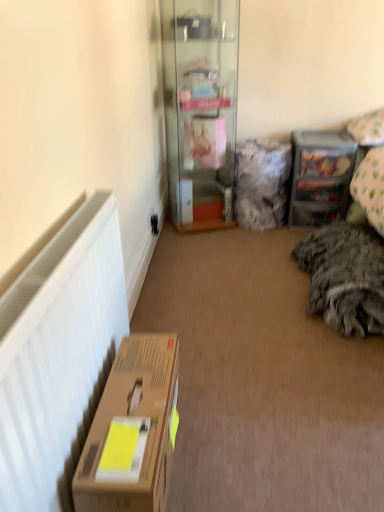
Image resolution: width=384 pixels, height=512 pixels. What do you see at coordinates (58, 352) in the screenshot?
I see `white matte radiator at left` at bounding box center [58, 352].

Locate an element on the screen. clear glass cabinet at center is located at coordinates (200, 109).

Image resolution: width=384 pixels, height=512 pixels. What do you see at coordinates (368, 128) in the screenshot?
I see `white fabric pillow at upper right, acting as the second pillow starting from the left` at bounding box center [368, 128].

You are a GUI agent. You are given a task and a screenshot of the screen. Output one action in this format:
    pyautogui.click(x=<x>, y=<y>)
    Task: Click on the brown cardboard box at lower left
    This screenshot has width=384, height=512.
    Given the screenshot: What is the action you would take?
    pyautogui.click(x=132, y=430)

Which point is more distant from viewer, (x=106, y=496) or (x=58, y=439)?

The point (x=58, y=439) is more distant.

Is white matte radiator at left a part of brown cardboard box at lower left?

Answer: No, brown cardboard box at lower left does not contain white matte radiator at left.

Between brown cardboard box at lower left and white matte radiator at left, which one has smaller size?

Smaller between the two is white matte radiator at left.

What's the angular difference between clear glass cabinet at center and clear plastic drawers at upper right's facing directions?

clear glass cabinet at center and clear plastic drawers at upper right are facing 15.3 degrees away from each other.

Is clear glass cabinet at center far from clear plastic drawers at upper right?

No.

Is clear glass cabinet at center wider than clear plastic drawers at upper right?

Yes, clear glass cabinet at center is wider than clear plastic drawers at upper right.

Does clear glass cabinet at center come in front of clear plastic drawers at upper right?

Yes, clear glass cabinet at center is closer to the camera.

Between point (108, 411) and point (373, 111), which one is positioned behind?

The point (373, 111) is farther from the camera.

Is brown cardboard box at lower left positioned in front of white fabric pillow at upper right, acting as the second pillow starting from the left?

Yes, it is.

Looking at their sizes, would you say brown cardboard box at lower left is wider or thinner than white fabric pillow at upper right, acting as the second pillow starting from the left?

In the image, brown cardboard box at lower left appears to be more narrow than white fabric pillow at upper right, acting as the second pillow starting from the left.

From the image's perspective, is clear plastic drawers at upper right located above or below white matte radiator at left?

clear plastic drawers at upper right is situated higher than white matte radiator at left in the image.

The width and height of the screenshot is (384, 512). I want to click on shelf positioned vertically above the white matte radiator at left (from a real-world perspective), so click(x=320, y=176).

Which is correct: clear plastic drawers at upper right is inside white matte radiator at left, or outside of it?

clear plastic drawers at upper right is spatially situated outside white matte radiator at left.

Between clear plastic drawers at upper right and white matte radiator at left, which one has larger size?

clear plastic drawers at upper right.

From a real-world perspective, which is physically below, clear plastic drawers at upper right or dark gray textured blanket at right?

dark gray textured blanket at right.

Could you tell me if clear plastic drawers at upper right is turned towards dark gray textured blanket at right?

Yes, clear plastic drawers at upper right is facing dark gray textured blanket at right.

Which object is further away from the camera taking this photo, clear plastic drawers at upper right or dark gray textured blanket at right?

clear plastic drawers at upper right is further away from the camera.

Would you consider clear plastic drawers at upper right to be distant from dark gray textured blanket at right?

No, clear plastic drawers at upper right is in close proximity to dark gray textured blanket at right.

Identify the location of cabinetry behind the dark gray textured blanket at right. (200, 109).

Looking at this image, is dark gray textured blanket at right far from clear glass cabinet at center?

Indeed, dark gray textured blanket at right is not near clear glass cabinet at center.

Does dark gray textured blanket at right have a greater width compared to clear glass cabinet at center?

Indeed, dark gray textured blanket at right has a greater width compared to clear glass cabinet at center.

Can you confirm if dark gray textured blanket at right is positioned to the left of clear glass cabinet at center?

Incorrect, dark gray textured blanket at right is not on the left side of clear glass cabinet at center.

Which is more to the left, brown cardboard box at lower left or clear plastic drawers at upper right?

brown cardboard box at lower left is more to the left.

Is the position of brown cardboard box at lower left less distant than that of clear plastic drawers at upper right?

Yes, it is.

From a real-world perspective, does brown cardboard box at lower left stand above clear plastic drawers at upper right?

No.

Where is `radiator that appears below the brown cardboard box at lower left (from a real-world perspective)`? This screenshot has width=384, height=512. radiator that appears below the brown cardboard box at lower left (from a real-world perspective) is located at coordinates (58, 352).

This screenshot has width=384, height=512. What are the coordinates of `shelf on the right of the clear glass cabinet at center` in the screenshot? It's located at (320, 176).

Based on their spatial positions, is clear glass cabinet at center or dark gray textured blanket at right further from clear plastic drawers at upper right?

clear glass cabinet at center.

In the scene shown: Based on their spatial positions, is white fabric pillow at upper right, acting as the second pillow starting from the left, or dark gray textured blanket at right further from clear glass cabinet at center?

dark gray textured blanket at right is positioned further to the anchor clear glass cabinet at center.

Based on their spatial positions, is white fabric pillow at upper right, the first pillow when ordered from right to left, or clear glass cabinet at center closer to dark gray textured blanket at right?

white fabric pillow at upper right, the first pillow when ordered from right to left.

Considering their positions, is clear glass cabinet at center positioned closer to fuzzy fabric pillow at center, marked as the first pillow in a left-to-right arrangement, than white fabric pillow at upper right, the first pillow when ordered from right to left?

The object closer to fuzzy fabric pillow at center, marked as the first pillow in a left-to-right arrangement, is clear glass cabinet at center.

Which object lies nearer to the anchor point white fabric pillow at upper right, the first pillow when ordered from right to left, clear glass cabinet at center or clear plastic drawers at upper right?

clear plastic drawers at upper right is closer to white fabric pillow at upper right, the first pillow when ordered from right to left.

Estimate the real-world distances between objects in this image. Which object is closer to white matte radiator at left, clear glass cabinet at center or clear plastic drawers at upper right?

clear glass cabinet at center is positioned closer to the anchor white matte radiator at left.

Looking at the image, which one is located closer to fuzzy fabric pillow at center, marked as the first pillow in a left-to-right arrangement, brown cardboard box at lower left or clear glass cabinet at center?

clear glass cabinet at center.

Based on their spatial positions, is fuzzy fabric pillow at center, marked as the first pillow in a left-to-right arrangement, or brown cardboard box at lower left further from white fabric pillow at upper right, acting as the second pillow starting from the left?

The object further to white fabric pillow at upper right, acting as the second pillow starting from the left, is brown cardboard box at lower left.

Locate an element on the screen. The height and width of the screenshot is (512, 384). bedding between clear glass cabinet at center and brown cardboard box at lower left vertically is located at coordinates (345, 276).

You are a GUI agent. You are given a task and a screenshot of the screen. Output one action in this format:
    pyautogui.click(x=<x>, y=<y>)
    Task: Click on the pillow located between clear glass cabinet at center and white fabric pillow at upper right, the first pillow when ordered from right to left, in the left-right direction
    
    Given the screenshot: What is the action you would take?
    pyautogui.click(x=262, y=184)

Locate an element on the screen. This screenshot has width=384, height=512. bedding between brown cardboard box at lower left and white fabric pillow at upper right, the first pillow when ordered from right to left, from front to back is located at coordinates (345, 276).

This screenshot has width=384, height=512. I want to click on cabinetry located between white matte radiator at left and clear plastic drawers at upper right in the depth direction, so click(200, 109).